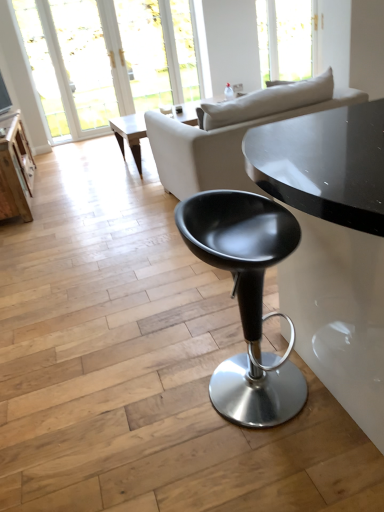
Question: Is light wood coffee table at center shorter than matte black stool at center?

Choices:
 (A) no
 (B) yes

Answer: (B)

Question: Is light wood coffee table at center facing towards matte black stool at center?

Choices:
 (A) no
 (B) yes

Answer: (B)

Question: From the image's perspective, would you say light wood coffee table at center is shown under matte black stool at center?

Choices:
 (A) yes
 (B) no

Answer: (B)

Question: From the image's perspective, is light wood coffee table at center over matte black stool at center?

Choices:
 (A) no
 (B) yes

Answer: (B)

Question: From a real-world perspective, does light wood coffee table at center sit lower than matte black stool at center?

Choices:
 (A) no
 (B) yes

Answer: (B)

Question: Can you confirm if light wood coffee table at center is wider than matte black stool at center?

Choices:
 (A) no
 (B) yes

Answer: (B)

Question: Is matte black stool at center shorter than light wood coffee table at center?

Choices:
 (A) no
 (B) yes

Answer: (A)

Question: Does matte black stool at center appear on the right side of light wood coffee table at center?

Choices:
 (A) no
 (B) yes

Answer: (B)

Question: From the image's perspective, is matte black stool at center below light wood coffee table at center?

Choices:
 (A) no
 (B) yes

Answer: (B)

Question: Does matte black stool at center have a greater height compared to light wood coffee table at center?

Choices:
 (A) yes
 (B) no

Answer: (A)

Question: Considering the relative sizes of matte black stool at center and light wood coffee table at center in the image provided, is matte black stool at center wider than light wood coffee table at center?

Choices:
 (A) no
 (B) yes

Answer: (A)

Question: From a real-world perspective, is matte black stool at center physically above light wood coffee table at center?

Choices:
 (A) yes
 (B) no

Answer: (A)

Question: Can we say transparent glass window at upper center lies outside transparent glass door at upper left?

Choices:
 (A) yes
 (B) no

Answer: (A)